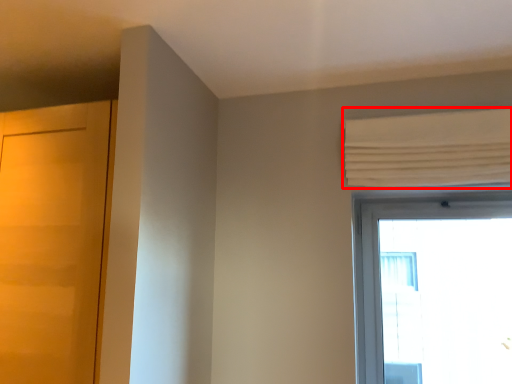
Question: From the image's perspective, considering the relative positions of curtain (annotated by the red box) and door in the image provided, where is curtain (annotated by the red box) located with respect to the staircase?

Choices:
 (A) above
 (B) below

Answer: (A)